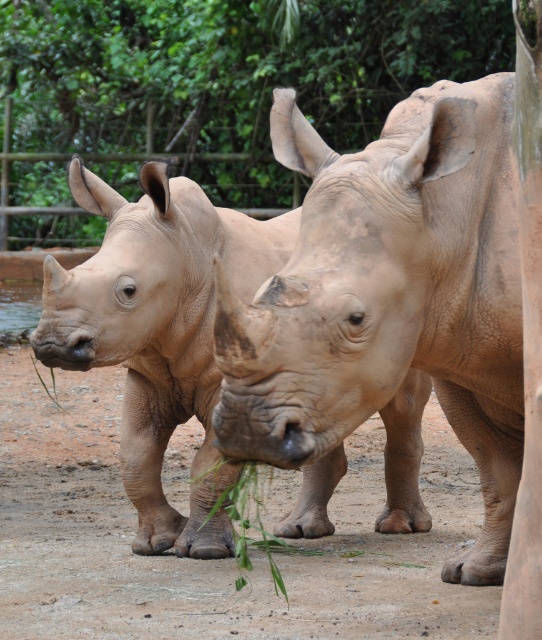
Does green leafy tree at center appear on the right side of green leafy plant at lower left?

Yes, green leafy tree at center is to the right of green leafy plant at lower left.

What are the coordinates of `green leafy tree at center` in the screenshot? It's located at (210, 90).

I want to click on green leafy tree at center, so click(210, 90).

Between green leafy tree at center and green leafy plant at center, which one is positioned lower?

green leafy plant at center is below.

Does green leafy tree at center have a lesser height compared to green leafy plant at center?

No.

Measure the distance between point (294, 17) and camera.

A distance of 13.86 meters exists between point (294, 17) and camera.

Identify the location of green leafy tree at center. The height and width of the screenshot is (640, 542). (210, 90).

Which of these two, green leafy tree at center or dull gray rhinoceros at center, stands taller?

green leafy tree at center is taller.

This screenshot has height=640, width=542. What do you see at coordinates (210, 90) in the screenshot? I see `green leafy tree at center` at bounding box center [210, 90].

Which is in front, point (241, 129) or point (269, 227)?

Positioned in front is point (269, 227).

Locate an element on the screen. green leafy tree at center is located at coordinates (210, 90).